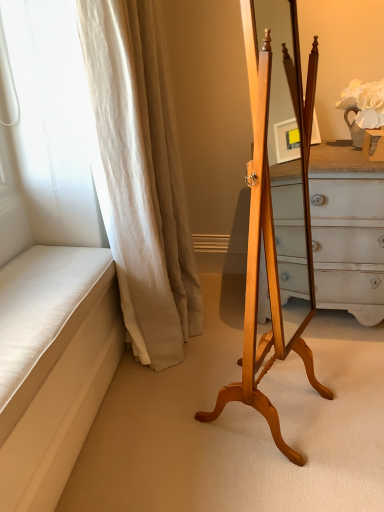
What do you see at coordinates (140, 176) in the screenshot?
I see `white fabric curtain at left` at bounding box center [140, 176].

At what (x,y) coordinates should I click in order to perform the action: click on white fabric curtain at left. Please return your answer as a coordinate pair (x, y). The width and height of the screenshot is (384, 512). Looking at the image, I should click on (140, 176).

Identify the location of light wood easel at center. (272, 230).

The height and width of the screenshot is (512, 384). What do you see at coordinates (272, 230) in the screenshot?
I see `light wood easel at center` at bounding box center [272, 230].

In order to face light wood easel at center, should I rotate leftwards or rightwards?

To align with it, rotate right about 11.354°.

You are a GUI agent. You are given a task and a screenshot of the screen. Output one action in this format:
    pyautogui.click(x=<x>, y=<y>)
    Task: Click on the white fabric curtain at left
    This screenshot has width=384, height=512.
    Given the screenshot: What is the action you would take?
    pyautogui.click(x=140, y=176)

Which is more to the right, white fabric curtain at left or light wood easel at center?

light wood easel at center is more to the right.

Is white fabric curtain at left further to camera compared to light wood easel at center?

Yes, white fabric curtain at left is further from the viewer.

Which point is more distant from viewer, (117, 96) or (276, 338)?

Positioned behind is point (117, 96).

From the image's perspective, is white fabric curtain at left on top of light wood easel at center?

Indeed, from the image's perspective, white fabric curtain at left is shown above light wood easel at center.

From a real-world perspective, is white fabric curtain at left over light wood easel at center?

Correct, in the physical world, white fabric curtain at left is higher than light wood easel at center.

Considering the sizes of objects white fabric curtain at left and light wood easel at center in the image provided, who is thinner, white fabric curtain at left or light wood easel at center?

Thinner between the two is light wood easel at center.

Can you confirm if white fabric curtain at left is taller than light wood easel at center?

Correct, white fabric curtain at left is much taller as light wood easel at center.

Who is smaller, white fabric curtain at left or light wood easel at center?

Smaller between the two is light wood easel at center.

Would you say white fabric curtain at left is outside light wood easel at center?

Yes, white fabric curtain at left is not within light wood easel at center.

Is white fabric curtain at left in contact with light wood easel at center?

No, white fabric curtain at left is not in contact with light wood easel at center.

Is white fabric curtain at left aimed at light wood easel at center?

No, white fabric curtain at left is not aimed at light wood easel at center.

How many degrees apart are the facing directions of white fabric curtain at left and light wood easel at center?

The angular difference between white fabric curtain at left and light wood easel at center is 64.4 degrees.

What are the coordinates of `curtain above the light wood easel at center (from a real-world perspective)` in the screenshot? It's located at (140, 176).

Which is more to the left, light wood easel at center or white fabric curtain at left?

From the viewer's perspective, white fabric curtain at left appears more on the left side.

In the scene shown: Is the depth of light wood easel at center less than that of white fabric curtain at left?

Yes, light wood easel at center is in front of white fabric curtain at left.

Based on the photo, which is less distant, (255,215) or (122,211)?

Positioned in front is point (255,215).

From the image's perspective, is light wood easel at center below white fabric curtain at left?

Yes, from the image's perspective, light wood easel at center is beneath white fabric curtain at left.

From a real-world perspective, is light wood easel at center positioned above or below white fabric curtain at left?

light wood easel at center is situated lower than white fabric curtain at left in the real world.

Considering the sizes of light wood easel at center and white fabric curtain at left in the image, is light wood easel at center wider or thinner than white fabric curtain at left?

In the image, light wood easel at center appears to be more narrow than white fabric curtain at left.

Considering the relative sizes of light wood easel at center and white fabric curtain at left in the image provided, is light wood easel at center taller than white fabric curtain at left?

In fact, light wood easel at center may be shorter than white fabric curtain at left.

Consider the image. Does light wood easel at center have a smaller size compared to white fabric curtain at left?

Yes.

Is light wood easel at center not within white fabric curtain at left?

Yes, light wood easel at center is located beyond the bounds of white fabric curtain at left.

Is light wood easel at center not close to white fabric curtain at left?

light wood easel at center is near white fabric curtain at left, not far away.

Is white fabric curtain at left at the back of light wood easel at center?

That's right, light wood easel at center is facing away from white fabric curtain at left.

Can you tell me how much light wood easel at center and white fabric curtain at left differ in facing direction?

64.4 degrees.

You are a GUI agent. You are given a task and a screenshot of the screen. Output one action in this format:
    pyautogui.click(x=<x>, y=<y>)
    Task: Click on the curtain above the light wood easel at center (from a real-world perspective)
    
    Given the screenshot: What is the action you would take?
    pyautogui.click(x=140, y=176)

Locate an element on the screen. This screenshot has height=512, width=384. easel below the white fabric curtain at left (from a real-world perspective) is located at coordinates (272, 230).

This screenshot has height=512, width=384. What are the coordinates of `curtain that appears above the light wood easel at center (from a real-world perspective)` in the screenshot? It's located at (140, 176).